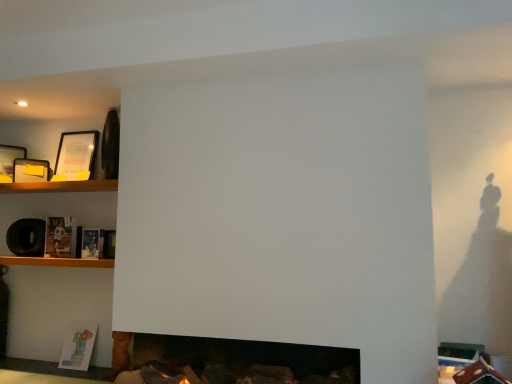
Question: Is matte paper book at lower left, which is counted as the first book, starting from the bottom, taller or shorter than matte black picture frame at left, the 2th picture frame from the right?

Choices:
 (A) tall
 (B) short

Answer: (A)

Question: From the image's perspective, relative to matte black picture frame at left, the 2th picture frame from the right, is matte paper book at lower left, which ranks as the third book in top-to-bottom order, above or below?

Choices:
 (A) below
 (B) above

Answer: (A)

Question: Which is nearer to the hardcover book at center-left, which appears as the 2th book when viewed from the top?

Choices:
 (A) matte black picture frame at left, the 2th picture frame from the right
 (B) matte paper book at lower left, which ranks as the third book in top-to-bottom order
 (C) matte paper book at left, positioned as the 3th book in bottom-to-top order
 (D) wooden shelf at lower left, which is the 2th shelf from top to bottom
 (E) matte black picture frame at upper left, marked as the first picture frame in a right-to-left arrangement

Answer: (C)

Question: Which object is positioned farthest from the matte black picture frame at left, which is counted as the second picture frame, starting from the left?

Choices:
 (A) hardcover book at center-left, which is the 2th book in bottom-to-top order
 (B) matte paper book at lower left, which ranks as the third book in top-to-bottom order
 (C) matte black picture frame at upper left, the third picture frame positioned from the left
 (D) matte paper book at left, which is the first book in top-to-bottom order
 (E) wooden shelf at lower left, which is the 2th shelf from top to bottom

Answer: (B)